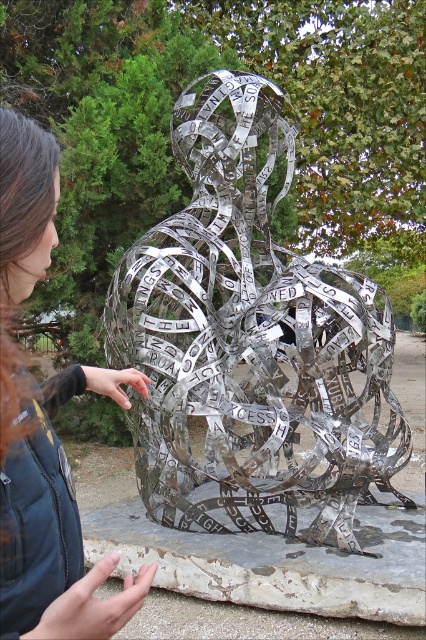
Is point (287, 276) more distant than point (71, 612)?

Yes, it is behind point (71, 612).

Is metallic silver sculpture at center positioned behind dark blue jacket at center?

Yes, metallic silver sculpture at center is further from the viewer.

Which is behind, point (331, 333) or point (135, 593)?

The point (331, 333) is more distant.

You are a GUI agent. You are given a task and a screenshot of the screen. Output one action in this format:
    pyautogui.click(x=<x>, y=<y>)
    Task: Click on the metallic silver sculpture at center
    This screenshot has width=426, height=640.
    Given the screenshot: What is the action you would take?
    pyautogui.click(x=250, y=340)